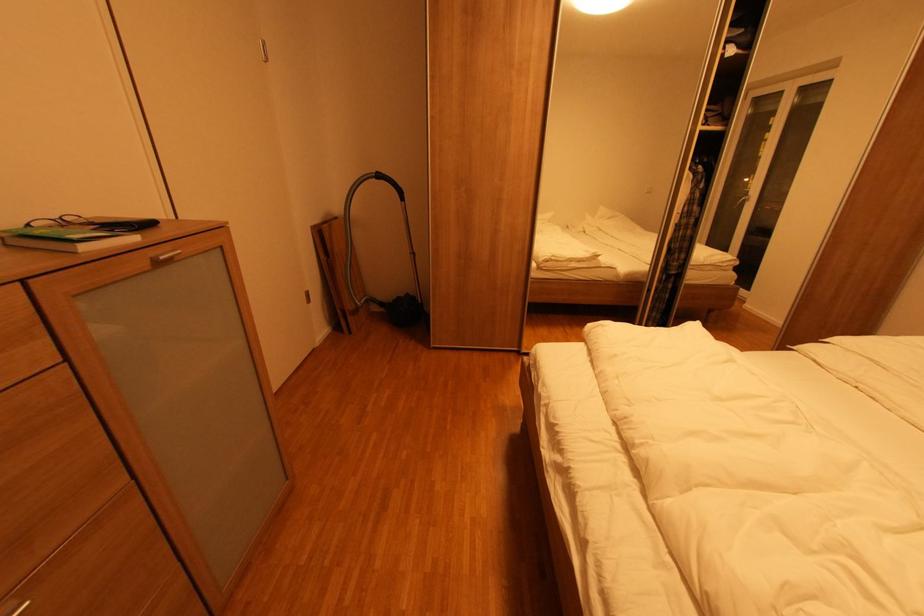
Find the location of `pair of glasses`. pair of glasses is located at coordinates (93, 223).